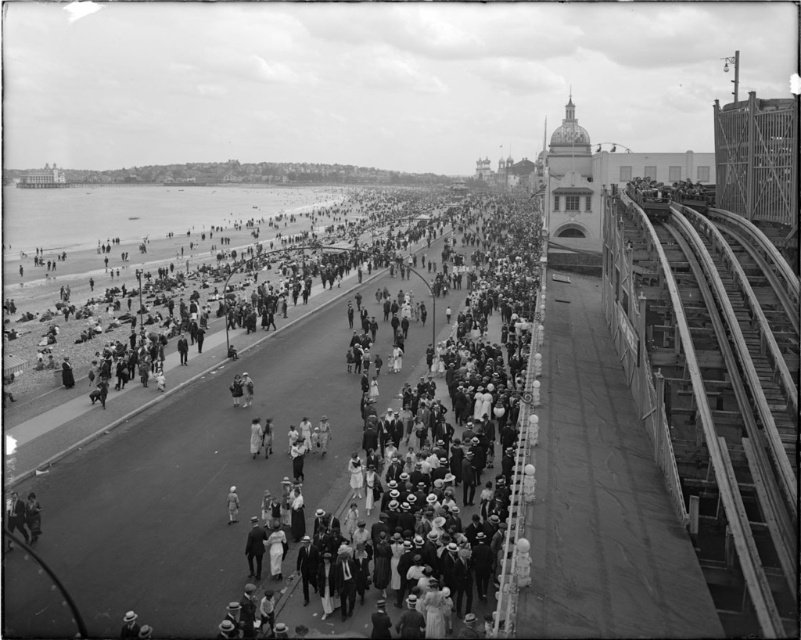
Question: Is white cotton dress at center thinner than smooth metal train track at right?

Choices:
 (A) yes
 (B) no

Answer: (B)

Question: Is white cotton dress at center bigger than smooth metal train track at right?

Choices:
 (A) yes
 (B) no

Answer: (A)

Question: Is white cotton dress at center closer to camera compared to smooth metal train track at right?

Choices:
 (A) yes
 (B) no

Answer: (B)